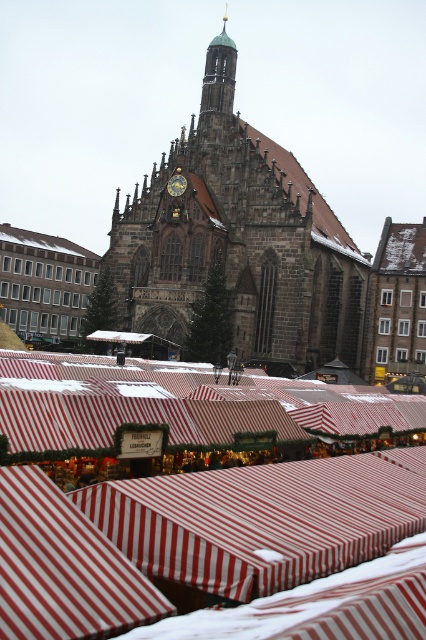
Does red striped awning at center come behind dark brown stone church at center?

That is False.

Is point (365, 541) farther from camera compared to point (287, 252)?

No, it is not.

Locate an element on the screen. The height and width of the screenshot is (640, 426). red striped awning at center is located at coordinates (173, 502).